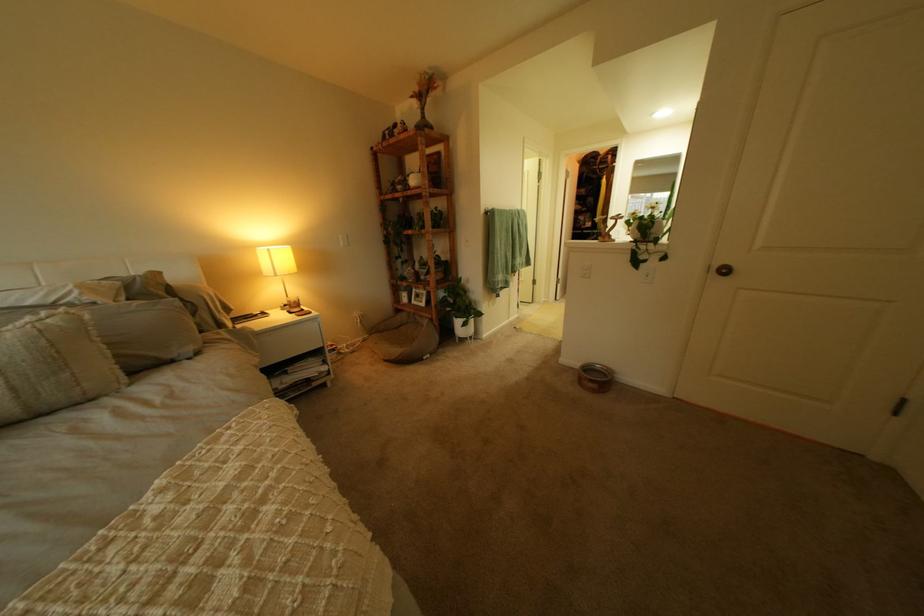
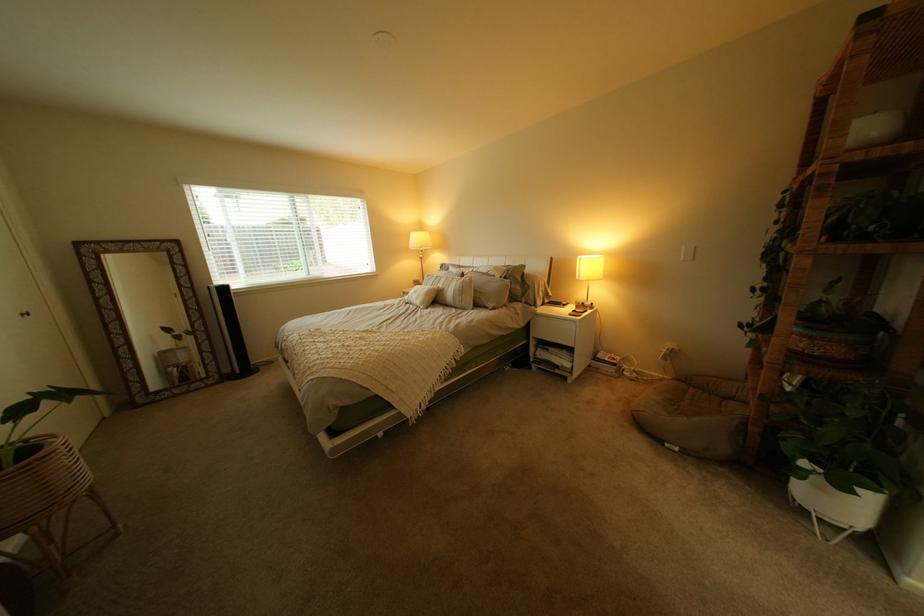
Find the pixel in the second image that matches the point at 312,315 in the first image.

(590, 314)